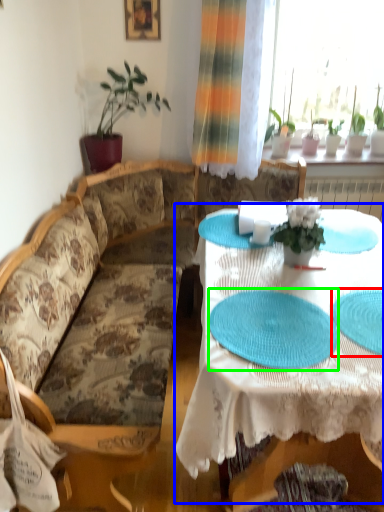
Question: Which is farther away from platter (highlighted by a red box)? table (highlighted by a blue box) or paper plate (highlighted by a green box)?

Choices:
 (A) table
 (B) paper plate

Answer: (A)